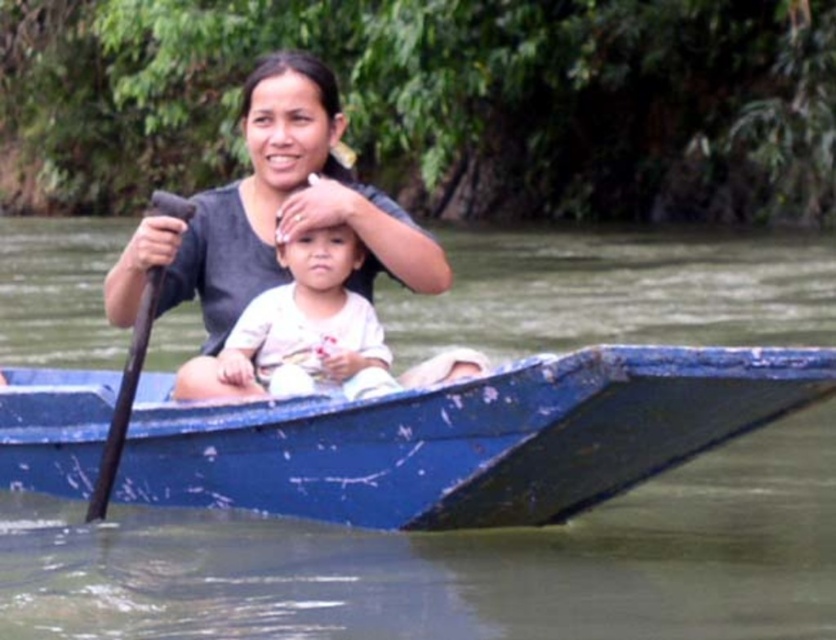
Question: Which point appears closest to the camera in this image?

Choices:
 (A) (541, 292)
 (B) (284, 112)

Answer: (B)

Question: Can you confirm if blue painted wood canoe at center is bigger than matte black shirt at center?

Choices:
 (A) no
 (B) yes

Answer: (B)

Question: Which of the following is the farthest from the observer?

Choices:
 (A) (811, 451)
 (B) (342, 316)

Answer: (A)

Question: Which object is farther from the camera taking this photo?

Choices:
 (A) blue painted wood canoe at center
 (B) dark brown wooden paddle at left

Answer: (B)

Question: Where is blue painted wood canoe at center located in relation to white cotton baby at center in the image?

Choices:
 (A) right
 (B) left

Answer: (B)

Question: Does greenish murky water at center appear over blue painted wood canoe at center?

Choices:
 (A) yes
 (B) no

Answer: (A)